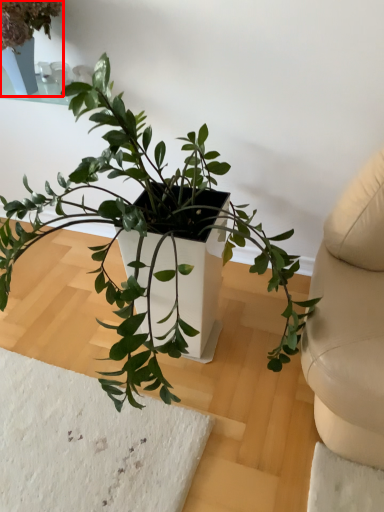
Question: Observing the image, what is the correct spatial positioning of houseplant (annotated by the red box) in reference to houseplant?

Choices:
 (A) left
 (B) right

Answer: (A)